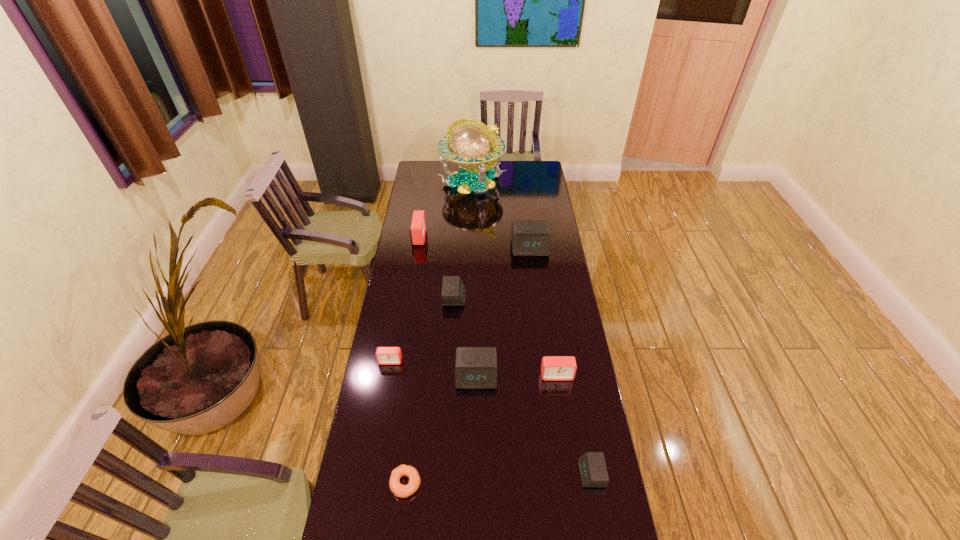
At what (x,y) coordinates should I click in order to perform the action: click on the smallest black alarm clock. Please return your answer as a coordinate pair (x, y). Looking at the image, I should click on (592, 466).

This screenshot has width=960, height=540. I want to click on the second shortest object, so click(x=592, y=466).

At what (x,y) coordinates should I click in order to perform the action: click on doughnut. Please return your answer as a coordinate pair (x, y). Looking at the image, I should click on (400, 490).

Identify the location of the shortest object. (400, 490).

Where is `vacant region located on the front of the tallest object`? This screenshot has width=960, height=540. vacant region located on the front of the tallest object is located at coordinates (471, 220).

This screenshot has width=960, height=540. I want to click on vacant region located on the front-facing side of the biggest red alarm clock, so click(x=473, y=237).

This screenshot has width=960, height=540. I want to click on vacant area situated on the front-facing side of the biggest black alarm clock, so click(x=533, y=274).

Identify the location of free location located 0.310m on the front-facing side of the third farthest black alarm clock. The image size is (960, 540). (475, 476).

Find the location of a particular element. vacant area situated on the front-facing side of the second smallest red alarm clock is located at coordinates (561, 401).

Identify the location of vacant position located 0.180m on the front-facing side of the second smallest black alarm clock. This screenshot has width=960, height=540. (506, 297).